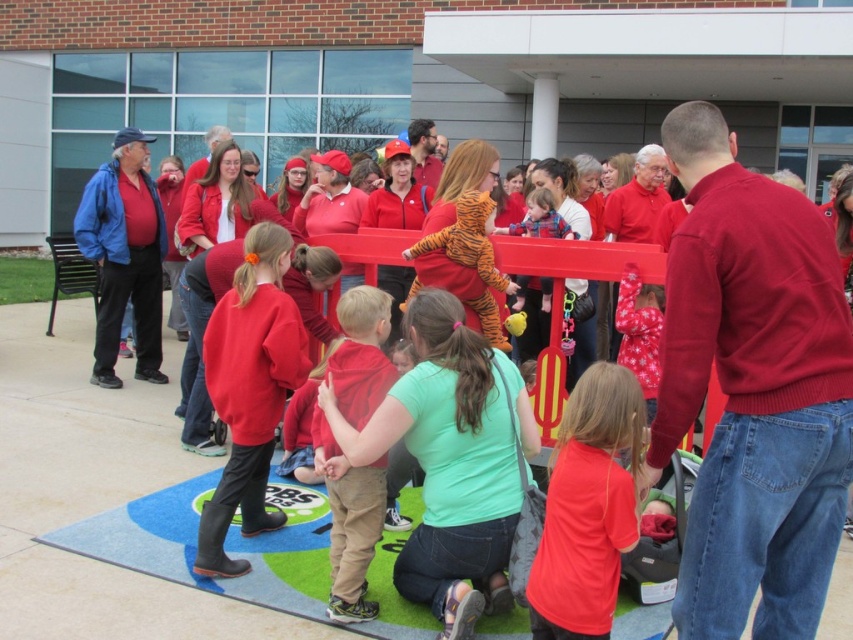
Between matte red shirt at center and matte red sweatshirt at center, which one appears on the right side from the viewer's perspective?

matte red shirt at center is more to the right.

Measure the distance between point (599, 545) and camera.

Point (599, 545) is 2.83 meters from camera.

This screenshot has width=853, height=640. What do you see at coordinates (589, 508) in the screenshot? I see `matte red shirt at center` at bounding box center [589, 508].

Where is `matte red shirt at center`? Image resolution: width=853 pixels, height=640 pixels. matte red shirt at center is located at coordinates coord(589,508).

Between blue artificial turf mat at lower center and matte red sweatshirt at center, which one appears on the left side from the viewer's perspective?

matte red sweatshirt at center

Is point (286, 573) behind point (239, 353)?

No, it is not.

Between point (322, 486) and point (213, 500), which one is positioned in front?

Point (213, 500)

Where is `blue artificial turf mat at lower center`? The height and width of the screenshot is (640, 853). blue artificial turf mat at lower center is located at coordinates (225, 541).

Is blue artificial turf mat at lower center taller than matte red shirt at center?

In fact, blue artificial turf mat at lower center may be shorter than matte red shirt at center.

Which of these two, blue artificial turf mat at lower center or matte red shirt at center, stands taller?

matte red shirt at center is taller.

At what (x,y) coordinates should I click in order to perform the action: click on blue artificial turf mat at lower center. Please return your answer as a coordinate pair (x, y). Looking at the image, I should click on (225, 541).